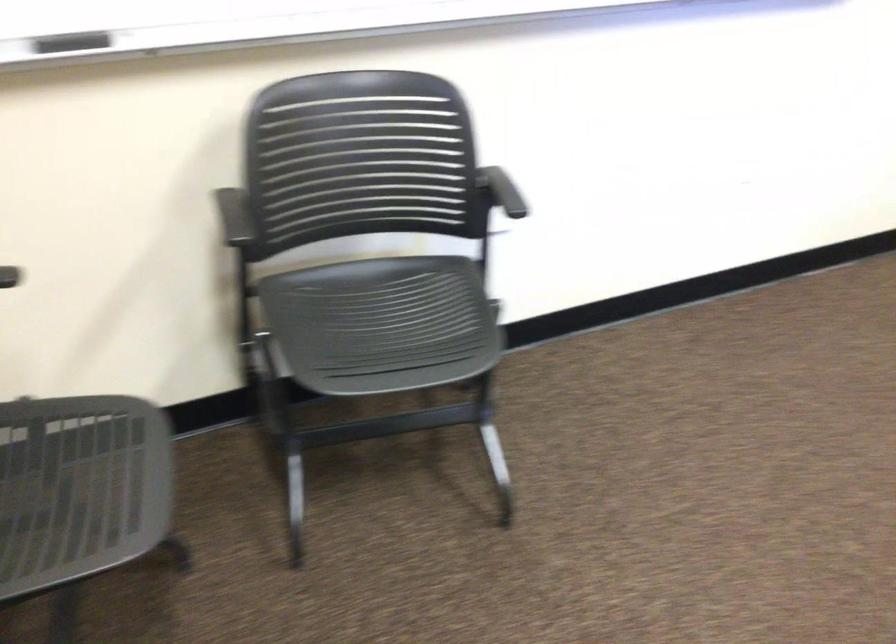
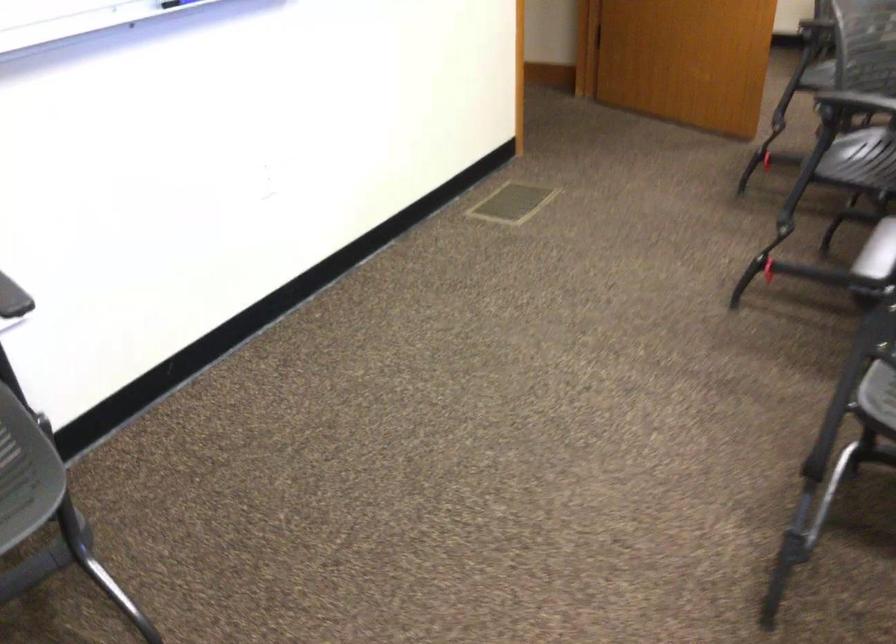
Locate, in the second image, the point that corresponds to (476,346) in the first image.

(26, 473)